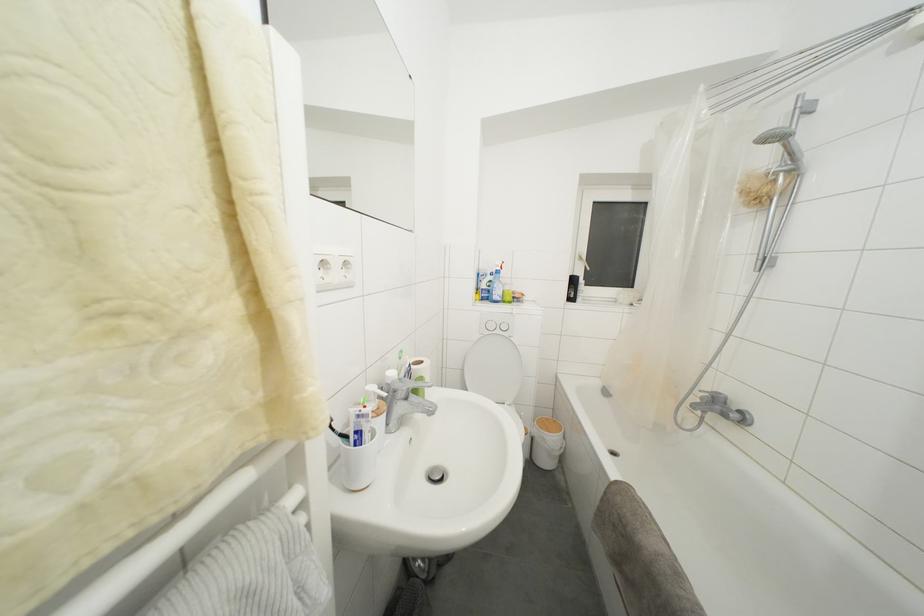
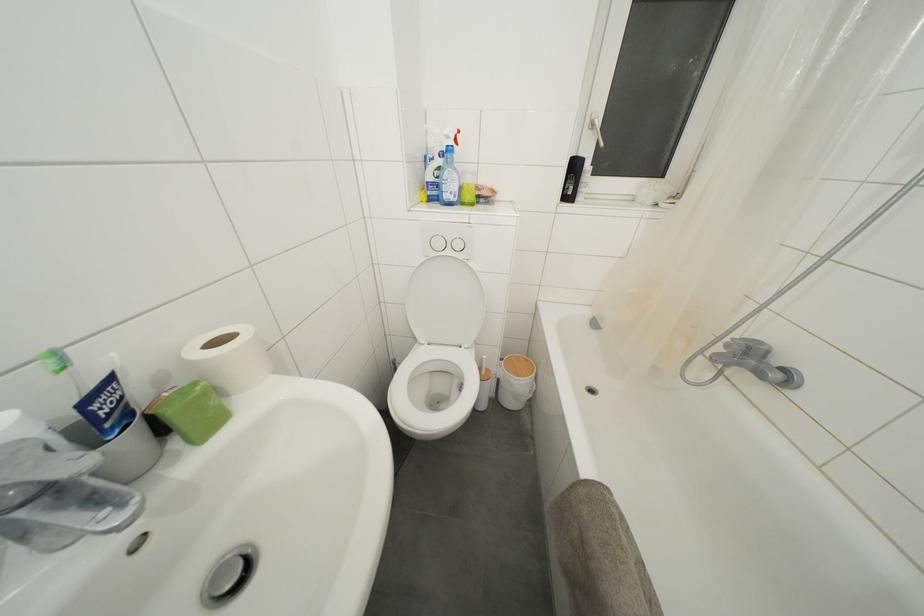
Where in the second image is the point corresponding to the point at 552,424 from the first image?

(521, 362)